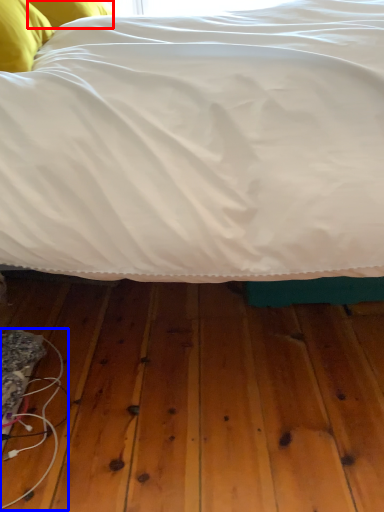
Question: Which point is closer to the camera, pillow (highlighted by a red box) or wire (highlighted by a blue box)?

Choices:
 (A) pillow
 (B) wire

Answer: (B)